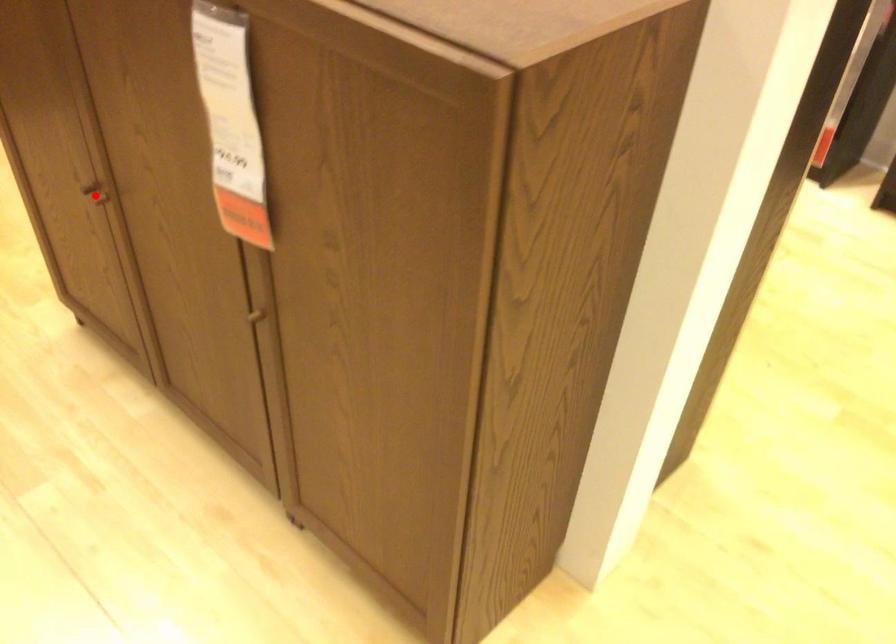
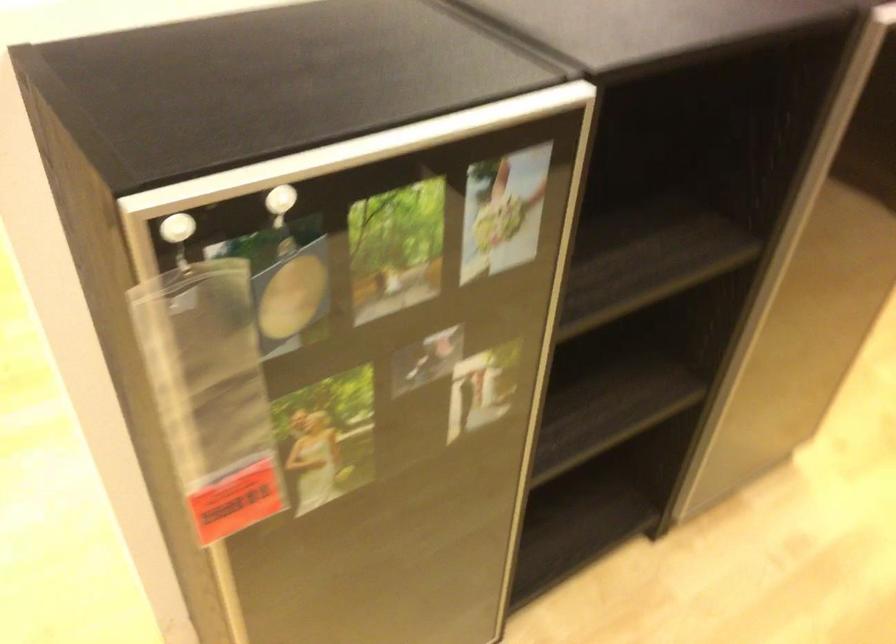
Question: I am providing you with two images of the same scene from different viewpoints. A red point is marked on the first image. At the location where the point appears in image 1, is it still visible in image 2?

Choices:
 (A) Yes
 (B) No

Answer: (B)